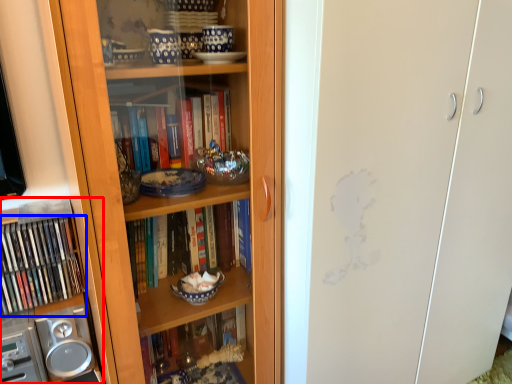
Question: Which point is further to the camera, cabinet (highlighted by a red box) or book (highlighted by a blue box)?

Choices:
 (A) cabinet
 (B) book

Answer: (B)